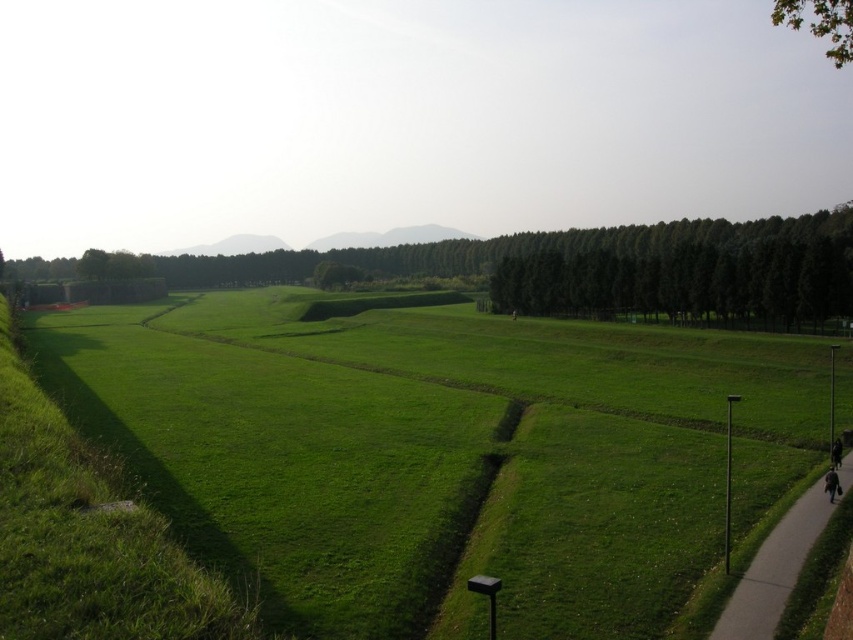
Question: Which object is the farthest from the green leafy trees at center?

Choices:
 (A) green grassy field at center
 (B) dark brown leather jacket at lower right
 (C) gray concrete sidewalk at lower right
 (D) black fabric person at lower right

Answer: (B)

Question: Is green leafy trees at center positioned at the back of gray concrete sidewalk at lower right?

Choices:
 (A) yes
 (B) no

Answer: (A)

Question: Does green grassy field at center appear on the left side of dark brown leather jacket at lower right?

Choices:
 (A) yes
 (B) no

Answer: (A)

Question: Among these points, which one is nearest to the camera?

Choices:
 (A) (798, 378)
 (B) (837, 465)
 (C) (740, 618)

Answer: (C)

Question: Can you confirm if green leafy tree at upper right is positioned above black fabric person at lower right?

Choices:
 (A) yes
 (B) no

Answer: (A)

Question: Which of the following is the farthest from the observer?

Choices:
 (A) green leafy tree at upper right
 (B) dark brown leather jacket at lower right

Answer: (B)